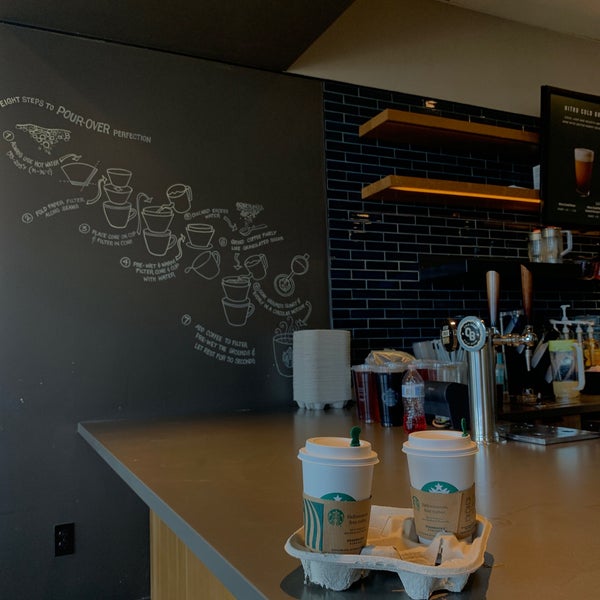
Find the location of a particular element. single cup holder is located at coordinates (399, 559).